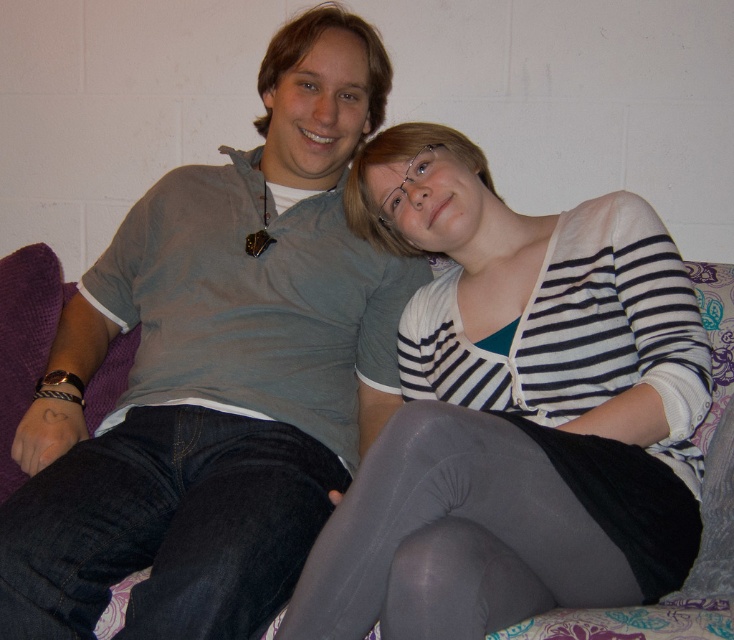
You are a photographer setting up a shoot in this living room scene. You need to place a small prop between the dark blue denim jeans at lower left and the gray tights at lower center. Based on their positions, where should you place the prop so it appears between them from the viewer perspective?

The dark blue denim jeans at lower left is closer to the viewer than the gray tights at lower center. To place the prop between them from the viewer perspective, position it closer to the dark blue denim jeans at lower left but still in front of the gray tights at lower center.

You are a photographer setting up a shoot in the scene described. You need to place a small prop between the striped knit cardigan at center and the gray tights at lower center. Based on their positions, where should you position the prop so it appears between them in the final photo?

The gray tights at lower center is behind the striped knit cardigan at center, so placing the prop in front of the gray tights at lower center but behind the striped knit cardigan at center would position it between them in the photo.

You are an interior designer planning to place a new sofa in the living room. You see the striped knit cardigan at center and the dark blue denim jeans at lower left in the image. Which object is closer to the viewer?

The striped knit cardigan at center is closer to the viewer because it is in front of the dark blue denim jeans at lower left.